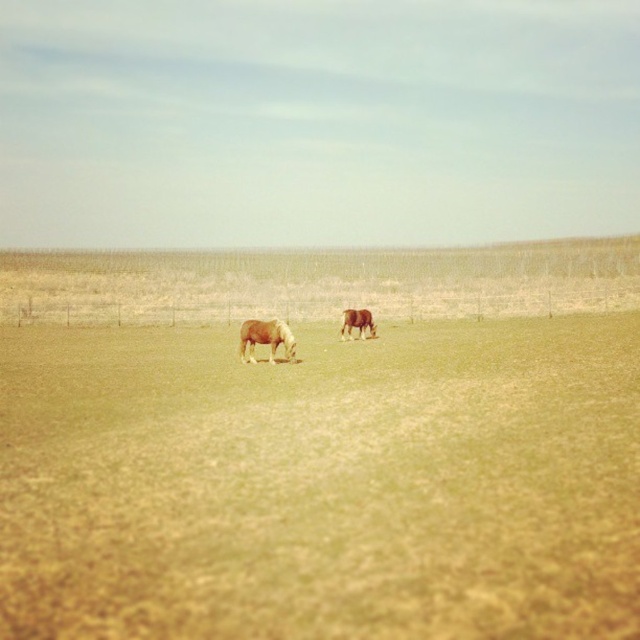
Between point (40, 620) and point (253, 339), which one is positioned in front?

Positioned in front is point (40, 620).

Is green grassy field at center in front of light brown horse at center?

Yes, it is in front of light brown horse at center.

Does point (620, 358) come in front of point (275, 344)?

That is True.

Find the location of a particular element. This screenshot has height=640, width=640. green grassy field at center is located at coordinates (323, 483).

Is point (540, 426) farther from viewer compared to point (349, 324)?

No, (540, 426) is in front of (349, 324).

Does green grassy field at center have a lesser height compared to brown matte horse at center?

In fact, green grassy field at center may be taller than brown matte horse at center.

Locate an element on the screen. The image size is (640, 640). green grassy field at center is located at coordinates (323, 483).

I want to click on green grassy field at center, so 323,483.

Can you confirm if light brown horse at center is taller than brown matte horse at center?

Indeed, light brown horse at center has a greater height compared to brown matte horse at center.

Which is below, light brown horse at center or brown matte horse at center?

Positioned lower is light brown horse at center.

Find the location of a particular element. Image resolution: width=640 pixels, height=640 pixels. light brown horse at center is located at coordinates (264, 339).